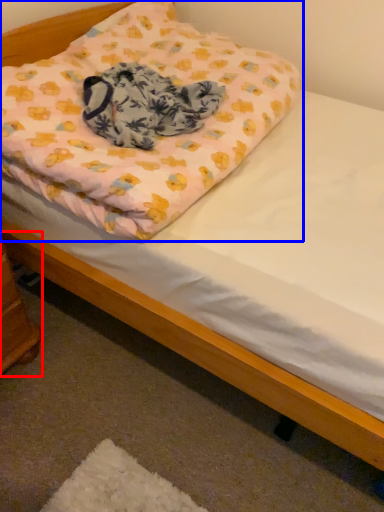
Question: Among these objects, which one is farthest to the camera, changing table (highlighted by a red box) or pillow (highlighted by a blue box)?

Choices:
 (A) changing table
 (B) pillow

Answer: (A)